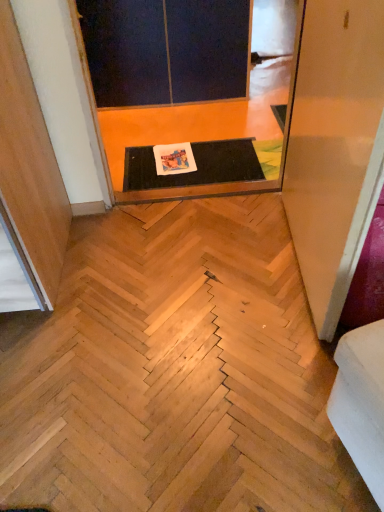
Identify the location of vacant region in front of dark matte screen door at upper center, acting as the third screen door starting from the front. (192, 141).